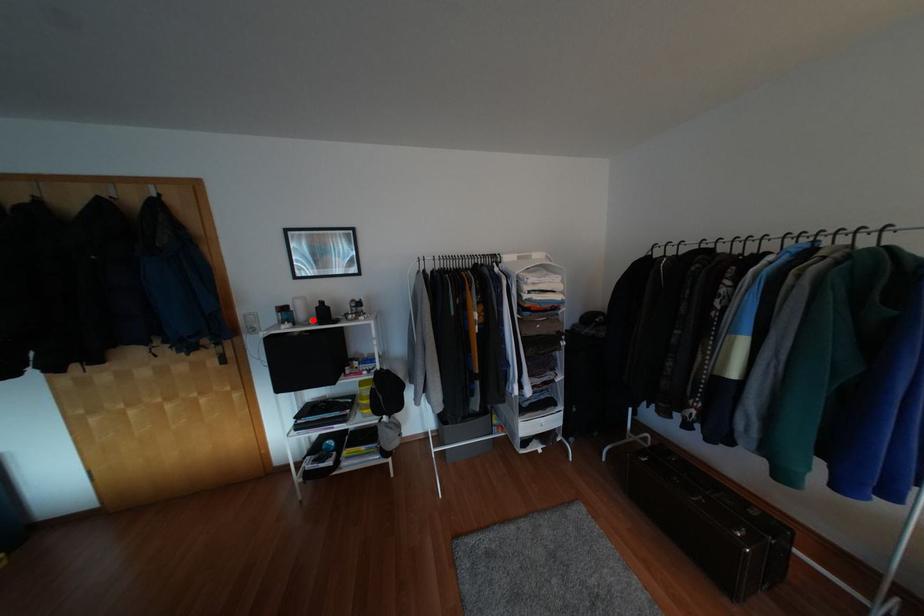
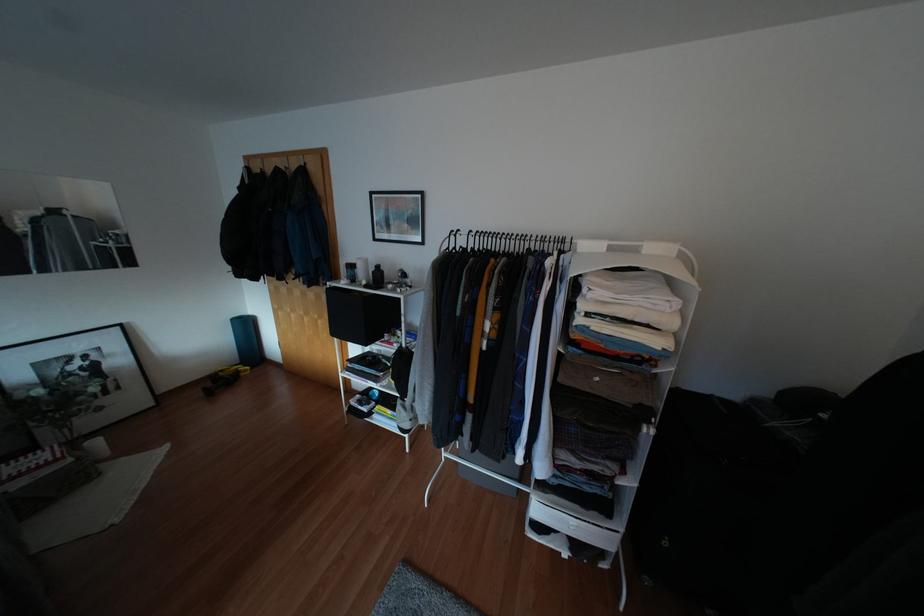
Question: I am providing you with two images of the same scene from different viewpoints. A red point is marked on the first image. At the location where the point appears in image 1, is it still visible in image 2?

Choices:
 (A) Yes
 (B) No

Answer: (A)